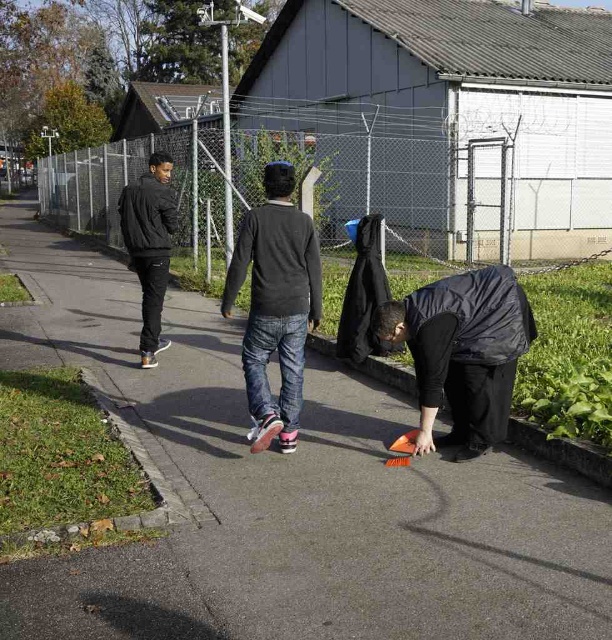
You are standing at the center of the pathway in the image. Which direction should you walk to reach the black matte jacket at lower right?

The black matte jacket at lower right is located at coordinates 0.552 on the x axis and 0.757 on the y axis. Since you are at the center, you should move towards the lower right direction to reach it.

You are standing on the smooth asphalt pavement at center and want to place the black matte jacket at lower right on it. Can you fit the jacket on the pavement without overlapping the edges?

The smooth asphalt pavement at center is larger in size than the black matte jacket at lower right, so yes, the jacket can be placed on the pavement without overlapping the edges.